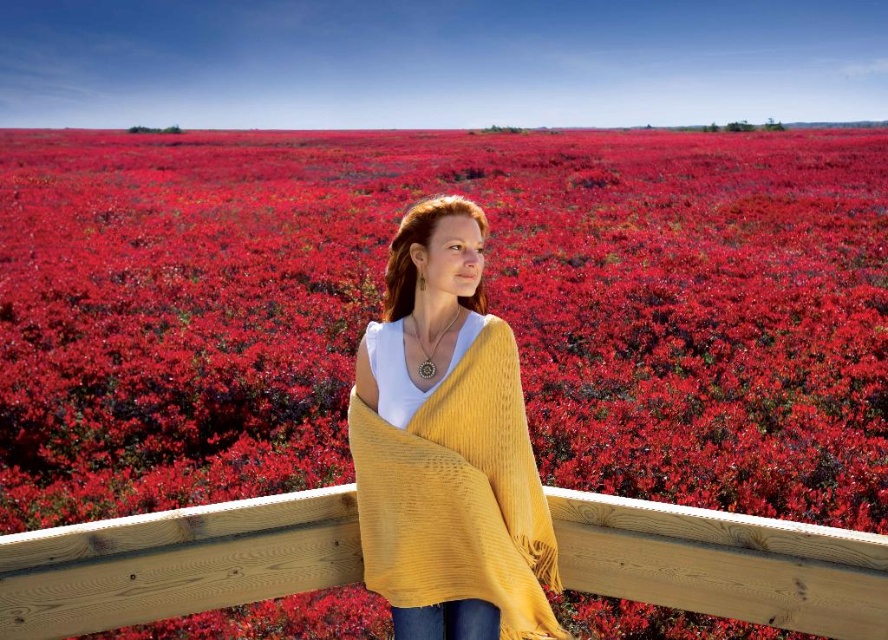
Question: Which object is farther from the camera taking this photo?

Choices:
 (A) wooden rail at center
 (B) mustard knit shawl at center

Answer: (B)

Question: Which point is closer to the camera?

Choices:
 (A) (x=647, y=602)
 (B) (x=430, y=300)

Answer: (A)

Question: Does wooden rail at center have a greater width compared to mustard knit shawl at center?

Choices:
 (A) no
 (B) yes

Answer: (B)

Question: Can you confirm if wooden rail at center is positioned to the right of mustard knit shawl at center?

Choices:
 (A) yes
 (B) no

Answer: (B)

Question: Which point appears closest to the camera in this image?

Choices:
 (A) (422, 257)
 (B) (284, 557)

Answer: (A)

Question: From the image, what is the correct spatial relationship of wooden rail at center in relation to mustard knit shawl at center?

Choices:
 (A) above
 (B) below

Answer: (B)